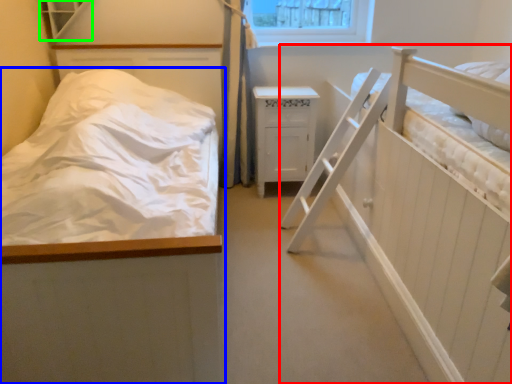
Question: Estimate the real-world distances between objects in this image. Which object is farther from hospital bed (highlighted by a red box), bed (highlighted by a blue box) or window (highlighted by a green box)?

Choices:
 (A) bed
 (B) window

Answer: (B)